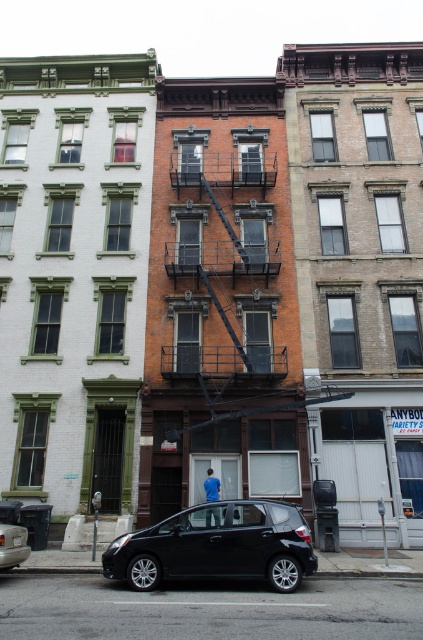
Question: Considering the relative positions of matte black car at lower center and black matte car at lower left in the image provided, where is matte black car at lower center located with respect to black matte car at lower left?

Choices:
 (A) left
 (B) right

Answer: (B)

Question: Which of the following is the farthest from the observer?

Choices:
 (A) matte black car at lower center
 (B) black matte car at lower left

Answer: (B)

Question: Considering the relative positions of matte black car at lower center and black matte car at lower left in the image provided, where is matte black car at lower center located with respect to black matte car at lower left?

Choices:
 (A) right
 (B) left

Answer: (A)

Question: Is matte black car at lower center closer to camera compared to black matte car at lower left?

Choices:
 (A) no
 (B) yes

Answer: (B)